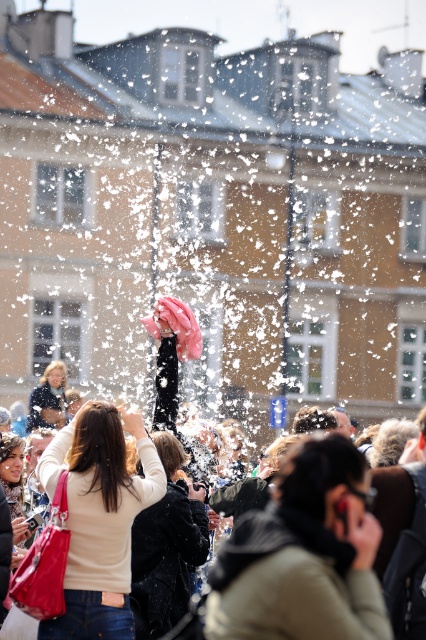
You are trying to decide which item to wear for an event. You have a light brown leather jacket at center and a matte beige sweater at center. Which one takes up more space when laid flat?

The light brown leather jacket at center might be wider than matte beige sweater at center, so it likely takes up more space when laid flat.

You are attending an event and see the matte beige sweater at center and the velvet black coat at center. Which one is positioned higher?

The matte beige sweater at center is positioned higher than the velvet black coat at center.